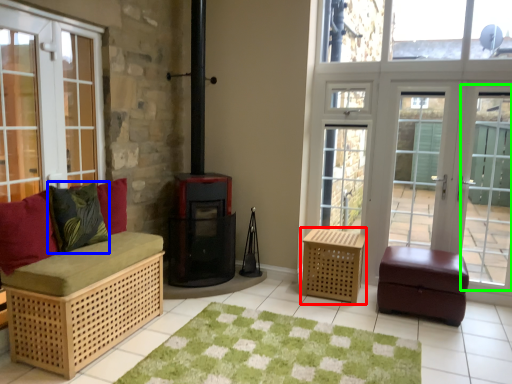
Question: Which is nearer to the furniture (highlighted by a red box)? pillow (highlighted by a blue box) or screen door (highlighted by a green box).

Choices:
 (A) pillow
 (B) screen door

Answer: (B)